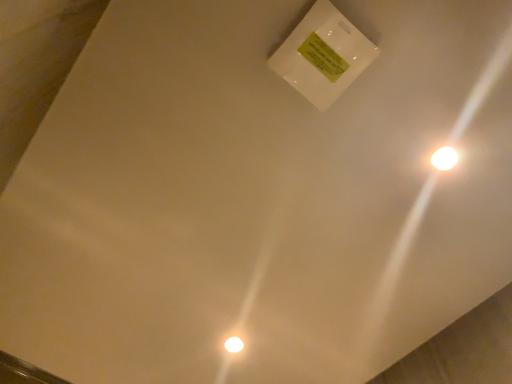
Find the location of a particular element. This screenshot has height=384, width=512. free location to the right of white glossy light at upper right is located at coordinates (487, 165).